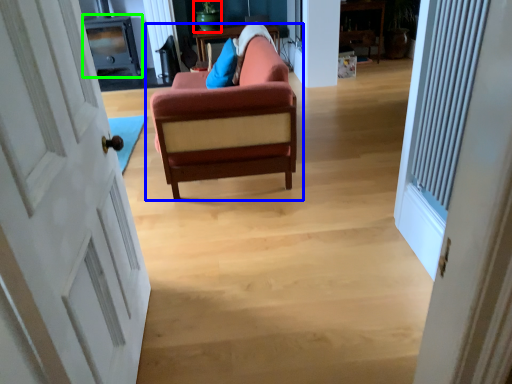
Question: Which object is positioned farthest from teal (highlighted by a red box)? Select from studio couch (highlighted by a blue box) and entertainment center (highlighted by a green box).

Choices:
 (A) studio couch
 (B) entertainment center

Answer: (A)